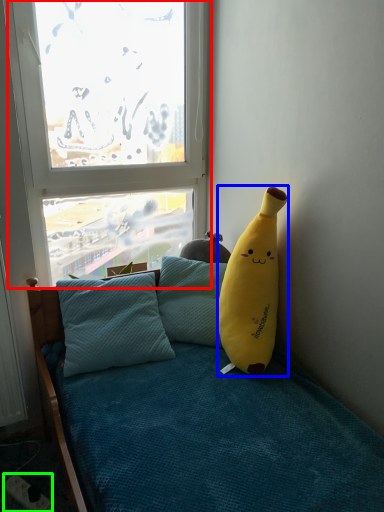
Question: Estimate the real-world distances between objects in this image. Which object is farther from window (highlighted by a red box), banana (highlighted by a blue box) or power outlet (highlighted by a green box)?

Choices:
 (A) banana
 (B) power outlet

Answer: (B)